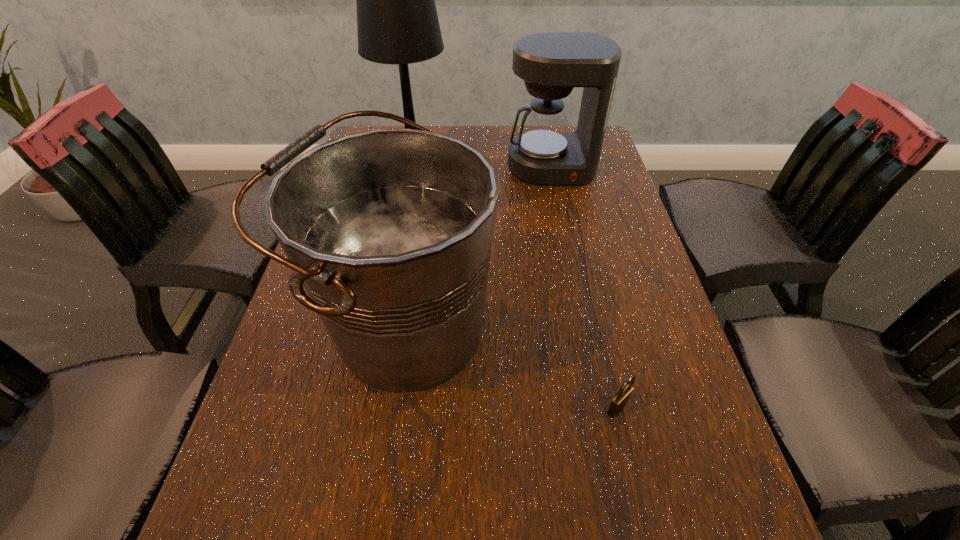
Find the location of a particular element. This screenshot has width=960, height=540. the tallest object is located at coordinates (397, 23).

This screenshot has width=960, height=540. In order to click on bucket in this screenshot , I will do `click(390, 231)`.

You are a GUI agent. You are given a task and a screenshot of the screen. Output one action in this format:
    pyautogui.click(x=<x>, y=<y>)
    Task: Click on the coffee maker
    
    Given the screenshot: What is the action you would take?
    pyautogui.click(x=551, y=64)

Locate an element on the screen. the shortest object is located at coordinates (620, 400).

Locate an element on the screen. The width and height of the screenshot is (960, 540). vacant space located 0.320m on the front of the tallest object is located at coordinates (396, 269).

The image size is (960, 540). What are the coordinates of `free region located on the back of the bucket` in the screenshot? It's located at coord(425,198).

Identify the location of free region located 0.090m on the button side of the coffee maker. The height and width of the screenshot is (540, 960). (560, 208).

The width and height of the screenshot is (960, 540). What are the coordinates of `vacant space situated 0.180m on the left of the shortest object` in the screenshot? It's located at (503, 408).

The image size is (960, 540). Find the location of `table lamp that is at the far edge`. table lamp that is at the far edge is located at coordinates (397, 23).

What are the coordinates of `coffee maker located at the far edge` in the screenshot? It's located at (551, 64).